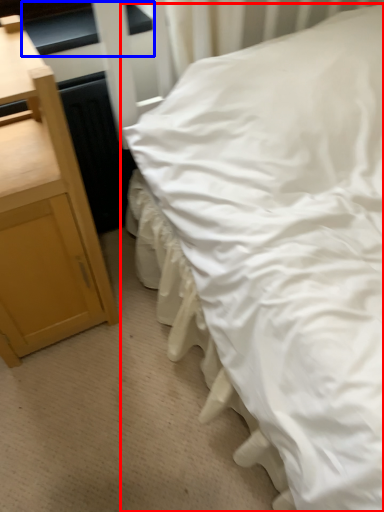
Question: Which object is further to the camera taking this photo, bed (highlighted by a red box) or window sill (highlighted by a blue box)?

Choices:
 (A) bed
 (B) window sill

Answer: (B)